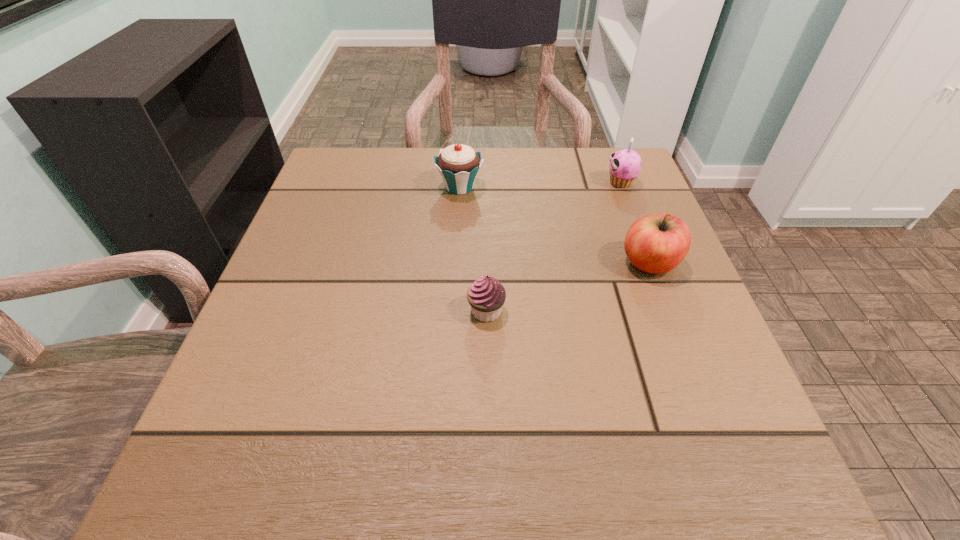
Find the location of `the rightmost cupcake`. the rightmost cupcake is located at coordinates (625, 165).

Where is `apple`? This screenshot has width=960, height=540. apple is located at coordinates (656, 243).

Where is `the nearest cupcake`? the nearest cupcake is located at coordinates (486, 296).

You are a GUI agent. You are given a task and a screenshot of the screen. Output one action in this format:
    pyautogui.click(x=<x>, y=<y>)
    Task: Click on the nearest object
    
    Given the screenshot: What is the action you would take?
    pyautogui.click(x=486, y=296)

Locate an element on the screen. The height and width of the screenshot is (540, 960). vacant space situated on the face of the rightmost cupcake is located at coordinates (538, 183).

Identify the location of free space located 0.370m on the face of the rightmost cupcake. (448, 183).

The height and width of the screenshot is (540, 960). Identify the location of free space located on the face of the rightmost cupcake. (474, 183).

Image resolution: width=960 pixels, height=540 pixels. I want to click on vacant space situated 0.340m on the left of the apple, so point(443,263).

Where is `free region located on the right of the shortest object`? free region located on the right of the shortest object is located at coordinates (695, 311).

Locate an element on the screen. The image size is (960, 540). cupcake present at the right edge is located at coordinates (625, 165).